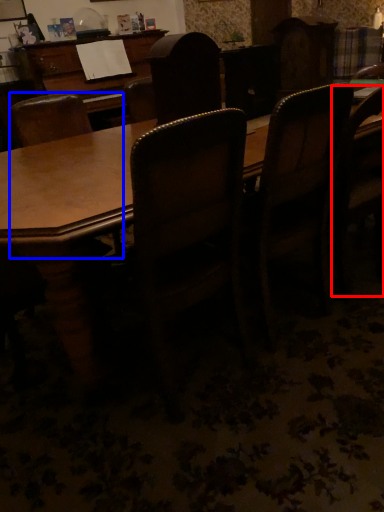
Question: Which object appears farthest to the camera in this image, chair (highlighted by a red box) or chair (highlighted by a blue box)?

Choices:
 (A) chair
 (B) chair

Answer: (A)